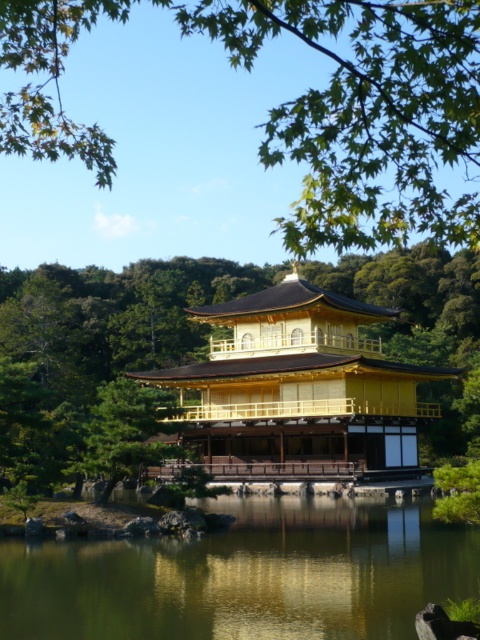
This screenshot has width=480, height=640. In order to click on green reflective water at center in this screenshot , I will do [247, 576].

Does green reflective water at center have a lesser height compared to gold lacquered wood palace at center?

Indeed, green reflective water at center has a lesser height compared to gold lacquered wood palace at center.

Is point (19, 620) farther from camera compared to point (228, 364)?

No, (19, 620) is closer to viewer.

I want to click on green reflective water at center, so click(247, 576).

How much distance is there between green leafy tree at upper center and gold lacquered wood palace at center?

24.19 meters

Between point (408, 234) and point (252, 301), which one is positioned in front?

Point (252, 301) is in front.

Does point (15, 109) come farther from viewer compared to point (346, 340)?

No, (15, 109) is in front of (346, 340).

Identify the location of green leafy tree at upper center. Image resolution: width=480 pixels, height=640 pixels. (299, 106).

The width and height of the screenshot is (480, 640). Describe the element at coordinates (299, 106) in the screenshot. I see `green leafy tree at upper center` at that location.

Can you confirm if green leafy tree at upper center is thinner than green reflective water at center?

Incorrect, green leafy tree at upper center's width is not less than green reflective water at center's.

Locate an element on the screen. Image resolution: width=480 pixels, height=640 pixels. green leafy tree at upper center is located at coordinates (299, 106).

Where is `green leafy tree at upper center`? Image resolution: width=480 pixels, height=640 pixels. green leafy tree at upper center is located at coordinates (299, 106).